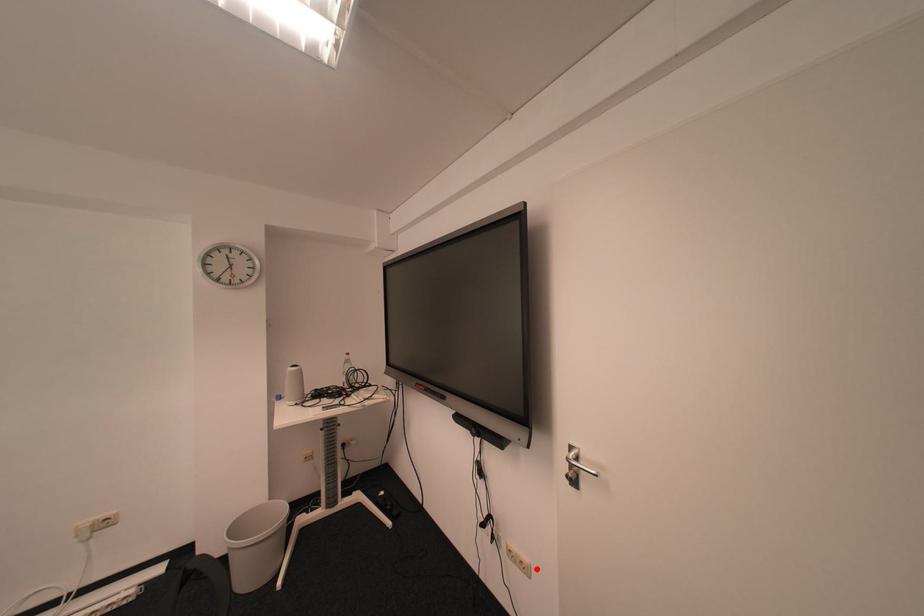
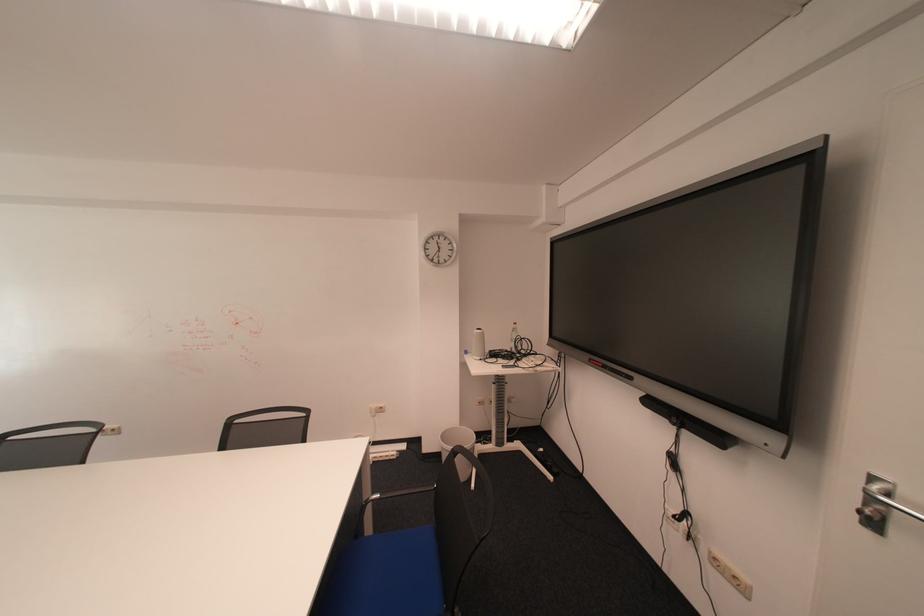
Find the pixel in the second image that matches the highlighted location in the first image.

(751, 586)